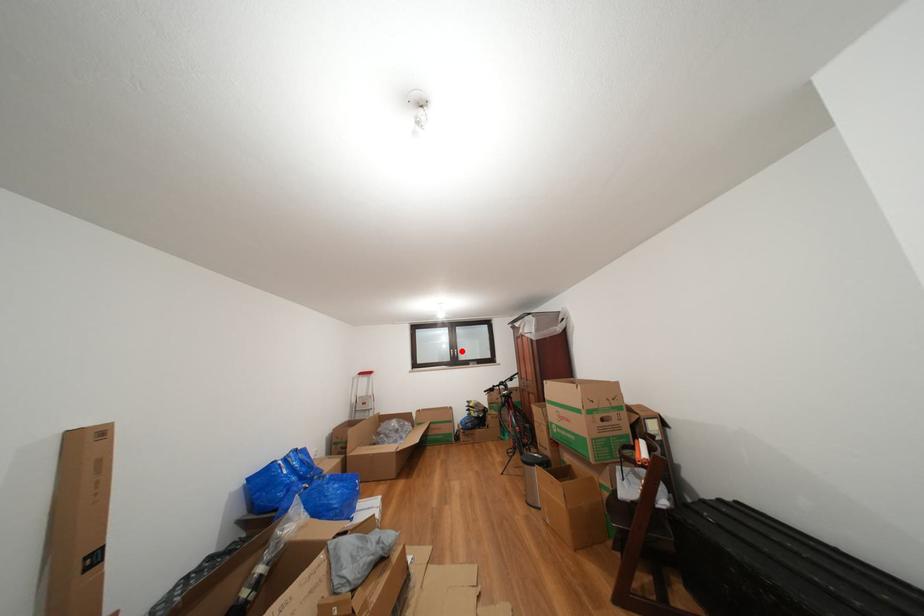
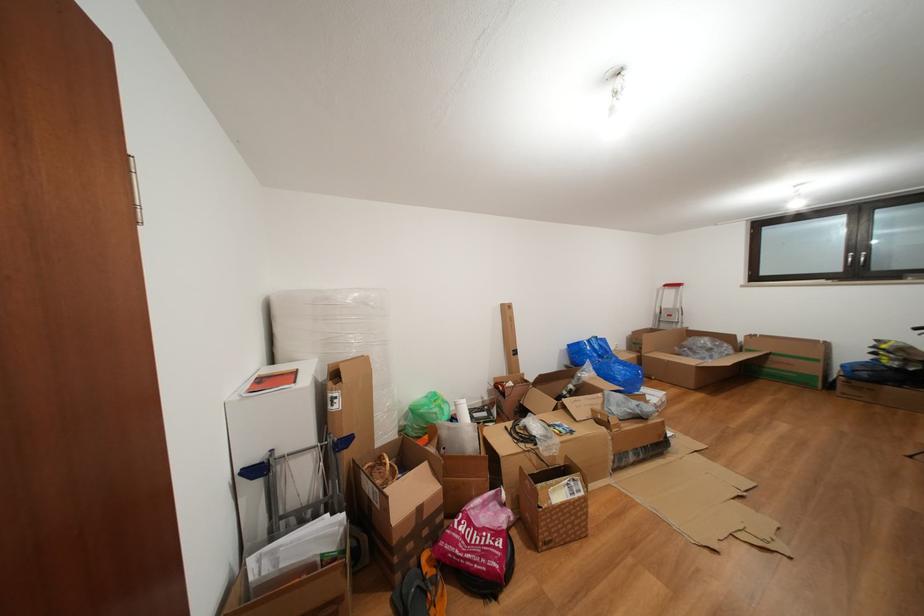
Question: I am providing you with two images of the same scene from different viewpoints. In image1, a red point is highlighted. Considering the same 3D point in image2, which of the following is correct?

Choices:
 (A) It is closer
 (B) It is farther

Answer: (A)